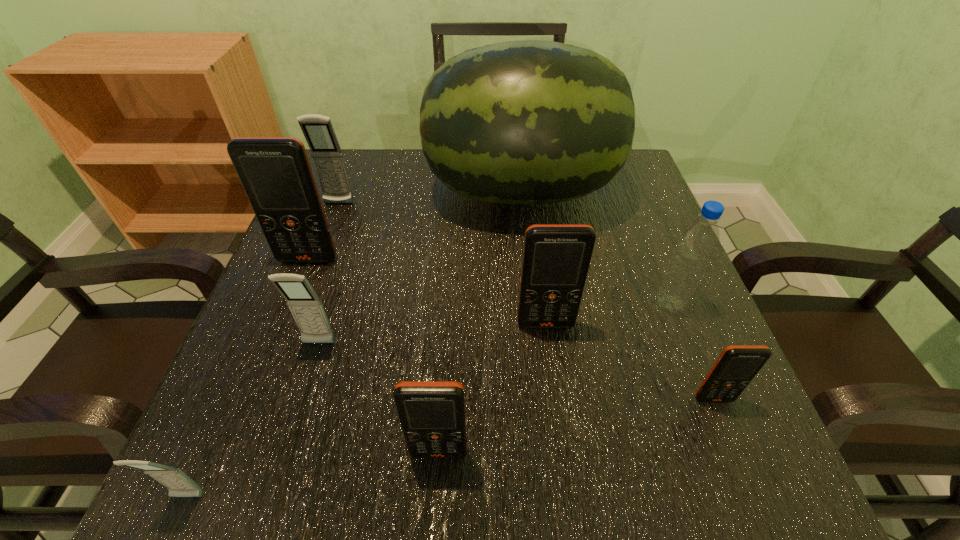
Find the location of a particular element. The height and width of the screenshot is (540, 960). object that is at the near left corner is located at coordinates (178, 483).

The height and width of the screenshot is (540, 960). I want to click on object that is at the far right corner, so pyautogui.click(x=526, y=122).

In the image, there is a desktop. Where is `vacant space at the far edge`? The image size is (960, 540). vacant space at the far edge is located at coordinates (412, 171).

In the image, there is a desktop. Where is `free space at the near edge`? The width and height of the screenshot is (960, 540). free space at the near edge is located at coordinates (566, 465).

The height and width of the screenshot is (540, 960). In the image, there is a desktop. Identify the location of vacant space at the left edge. (360, 207).

Find the location of `free space at the right edge of the desktop`. free space at the right edge of the desktop is located at coordinates (696, 357).

Where is `vacant space at the near left corner`? vacant space at the near left corner is located at coordinates (276, 503).

You are a GUI agent. You are given a task and a screenshot of the screen. Output one action in this format:
    pyautogui.click(x=<x>, y=<y>)
    Task: Click on the free space at the far right corner
    Image resolution: width=960 pixels, height=540 pixels.
    Given the screenshot: What is the action you would take?
    pyautogui.click(x=613, y=183)

The image size is (960, 540). In the image, there is a desktop. What are the coordinates of `blank space at the near right corner` in the screenshot? It's located at [764, 467].

This screenshot has height=540, width=960. Identify the location of free space between the nearest orange cellular telephone and the third farthest cellular telephone. (492, 389).